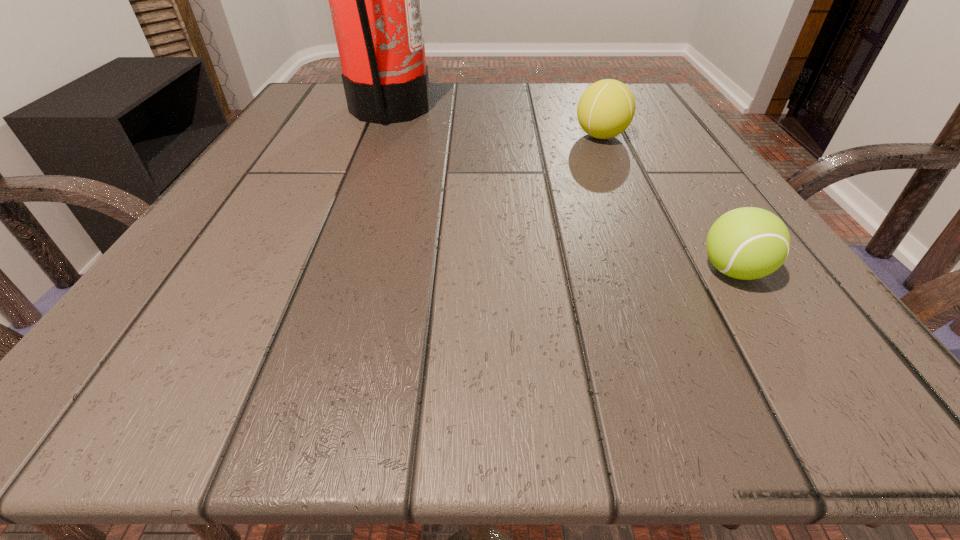
Where is `object present at the left edge`? object present at the left edge is located at coordinates (375, 0).

Locate an element on the screen. The image size is (960, 540). object at the far left corner is located at coordinates (375, 0).

This screenshot has width=960, height=540. Identify the location of object positioned at the far right corner. (606, 108).

You are a GUI agent. You are given a task and a screenshot of the screen. Output one action in this format:
    pyautogui.click(x=<x>, y=<y>)
    Task: Click on the vacant space at the far edge
    
    Given the screenshot: What is the action you would take?
    pyautogui.click(x=531, y=87)

Identify the location of vacant space at the near edge of the desktop. (599, 338).

Where is `vacant region at the left edge of the desktop`? This screenshot has width=960, height=540. vacant region at the left edge of the desktop is located at coordinates (257, 237).

In the image, there is a desktop. Where is `vacant area at the right edge`? vacant area at the right edge is located at coordinates (675, 162).

Where is `free space at the far left corner`? free space at the far left corner is located at coordinates (301, 114).

The image size is (960, 540). In order to click on vacant region at the near left corner of the desktop in this screenshot , I will do `click(210, 365)`.

What are the coordinates of `free space at the far right corner` in the screenshot? It's located at (663, 117).